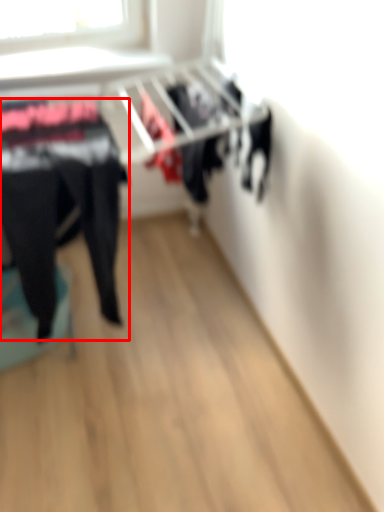
Question: From the image's perspective, what is the correct spatial positioning of clothing (annotated by the red box) in reference to furniture?

Choices:
 (A) above
 (B) below

Answer: (A)